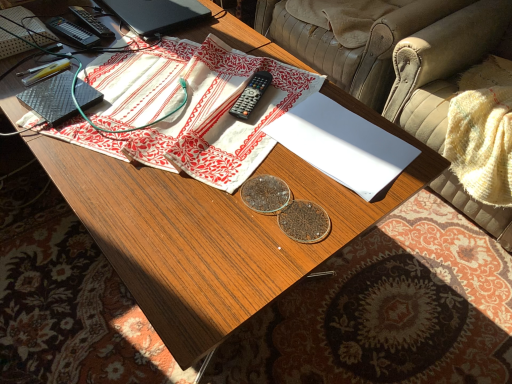
Question: Is white paper at center surrounding black matte laptop at upper left?

Choices:
 (A) no
 (B) yes

Answer: (A)

Question: Can we say white paper at center lies outside black matte laptop at upper left?

Choices:
 (A) no
 (B) yes

Answer: (B)

Question: Would you say white paper at center is a long distance from black matte laptop at upper left?

Choices:
 (A) yes
 (B) no

Answer: (B)

Question: From a real-world perspective, is white paper at center below black matte laptop at upper left?

Choices:
 (A) no
 (B) yes

Answer: (B)

Question: Considering the relative positions of white paper at center and black matte laptop at upper left in the image provided, is white paper at center to the right of black matte laptop at upper left from the viewer's perspective?

Choices:
 (A) yes
 (B) no

Answer: (A)

Question: Considering the relative positions of white paper at center and black matte laptop at upper left in the image provided, is white paper at center in front of black matte laptop at upper left?

Choices:
 (A) no
 (B) yes

Answer: (B)

Question: Is black plastic remote at center aimed at beige leather armchair at upper right, which is counted as the 1th armchair, starting from the front?

Choices:
 (A) no
 (B) yes

Answer: (A)

Question: Does black plastic remote at center have a lesser width compared to beige leather armchair at upper right, the 2th armchair in the back-to-front sequence?

Choices:
 (A) yes
 (B) no

Answer: (A)

Question: Is beige leather armchair at upper right, the 2th armchair in the back-to-front sequence, completely or partially inside black plastic remote at center?

Choices:
 (A) yes
 (B) no

Answer: (B)

Question: Is black plastic remote at center shorter than beige leather armchair at upper right, which is counted as the 1th armchair, starting from the front?

Choices:
 (A) no
 (B) yes

Answer: (B)

Question: Is black plastic remote at center wider than beige leather armchair at upper right, which is counted as the 1th armchair, starting from the front?

Choices:
 (A) no
 (B) yes

Answer: (A)

Question: Can you confirm if black plastic remote at center is taller than beige leather armchair at upper right, which is counted as the 1th armchair, starting from the front?

Choices:
 (A) no
 (B) yes

Answer: (A)

Question: Is white cotton cloth at center to the right of leather armchair at upper right, placed as the 1th armchair when sorted from back to front, from the viewer's perspective?

Choices:
 (A) no
 (B) yes

Answer: (A)